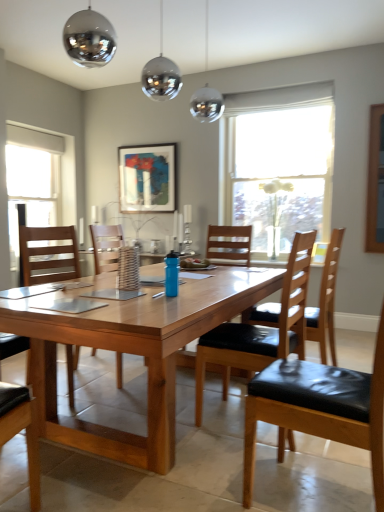
Question: From a real-world perspective, is clear glass vase at center, which appears as the second window when viewed from the left, positioned above or below black leather chair at center, which ranks as the second chair in left-to-right order?

Choices:
 (A) below
 (B) above

Answer: (B)

Question: Considering the positions of clear glass vase at center, which appears as the second window when viewed from the left, and black leather chair at center, arranged as the 3th chair when viewed from the right, in the image, is clear glass vase at center, which appears as the second window when viewed from the left, wider or thinner than black leather chair at center, arranged as the 3th chair when viewed from the right,?

Choices:
 (A) wide
 (B) thin

Answer: (B)

Question: Which object is the closest to the woven brown basket at center?

Choices:
 (A) black leather chair at center, which ranks as the second chair in left-to-right order
 (B) wooden table at center
 (C) shiny metallic globe at upper center
 (D) clear glass vase at center, placed as the first window when sorted from right to left
 (E) matte black picture frame at upper center

Answer: (B)

Question: Considering the real-world distances, which object is closest to the wooden chair at center, marked as the 4th chair in a right-to-left arrangement?

Choices:
 (A) blue matte water bottle at center
 (B) black leather chair at right, acting as the 3th chair starting from the left
 (C) black leather chair at center, arranged as the 3th chair when viewed from the right
 (D) white glass window at left, which ranks as the second window in right-to-left order
 (E) matte black picture frame at upper center

Answer: (A)